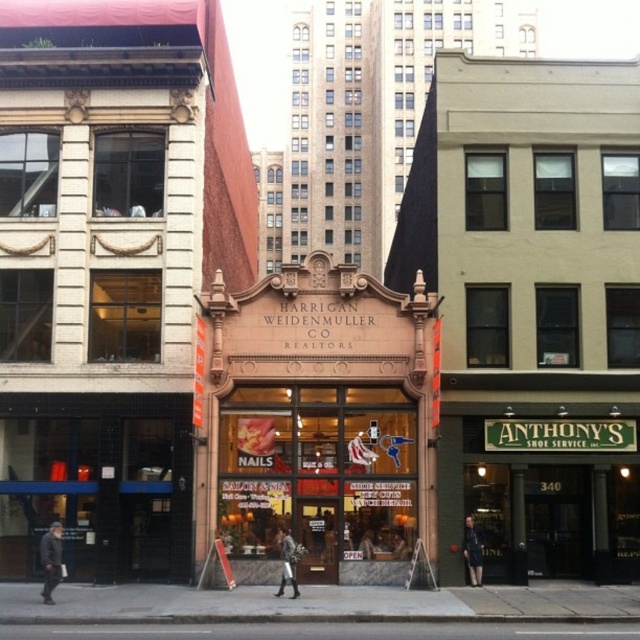
Between dark gray jacket at lower left and dark blue fabric coat at center, which one has less height?

Standing shorter between the two is dark blue fabric coat at center.

Can you confirm if dark gray jacket at lower left is positioned below dark blue fabric coat at center?

No, dark gray jacket at lower left is not below dark blue fabric coat at center.

Does point (60, 573) come behind point (468, 541)?

No.

Identify the location of dark gray jacket at lower left. (51, 560).

Does matte pink storefront at center have a greater height compared to leather jacket at center?

Indeed, matte pink storefront at center has a greater height compared to leather jacket at center.

Who is higher up, matte pink storefront at center or leather jacket at center?

matte pink storefront at center

Is point (280, 296) closer to viewer compared to point (292, 570)?

No, it is behind (292, 570).

Where is `matte pink storefront at center`? This screenshot has height=640, width=640. matte pink storefront at center is located at coordinates (321, 417).

Is dark gray jacket at lower left to the right of leather jacket at center from the viewer's perspective?

In fact, dark gray jacket at lower left is to the left of leather jacket at center.

Does dark gray jacket at lower left come in front of leather jacket at center?

Yes, it is in front of leather jacket at center.

Measure the distance between dark gray jacket at lower left and camera.

dark gray jacket at lower left and camera are 21.55 meters apart.

Where is `dark gray jacket at lower left`? The width and height of the screenshot is (640, 640). dark gray jacket at lower left is located at coordinates (51, 560).